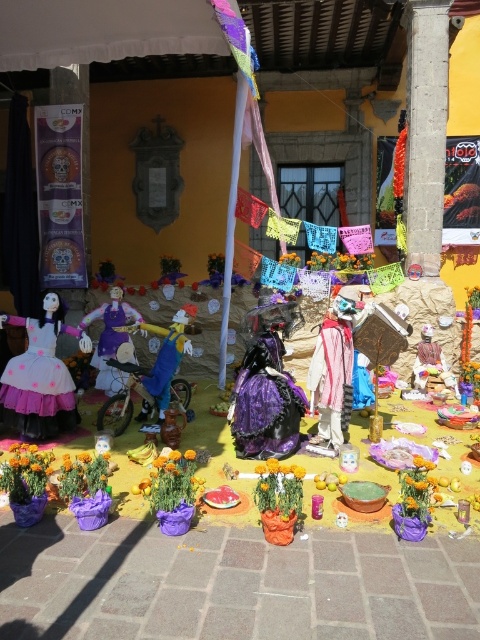
You are a photographer standing at the center of the scene. You want to take a photo that includes both point (179, 477) and point (424, 476). Which point will appear larger in your photo?

Point (179, 477) will appear larger in the photo because it is closer to the camera than point (424, 476).